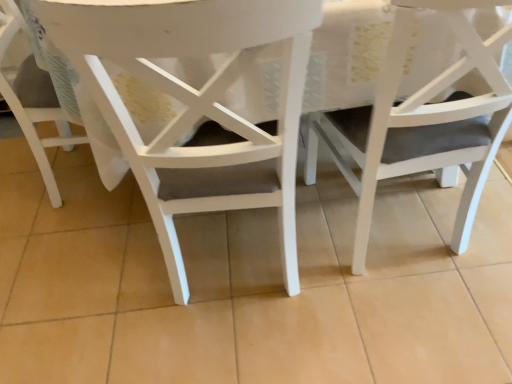
Question: Is white matte chair at center, which appears as the second chair when viewed from the left, completely or partially inside white matte chair at lower left, marked as the third chair in a right-to-left arrangement?

Choices:
 (A) no
 (B) yes

Answer: (A)

Question: From the image's perspective, is white matte chair at lower left, marked as the third chair in a right-to-left arrangement, on white matte chair at center, which appears as the second chair when viewed from the left?

Choices:
 (A) yes
 (B) no

Answer: (A)

Question: Is white matte chair at lower left, which is the first chair in left-to-right order, positioned behind white matte chair at center, which appears as the second chair when viewed from the left?

Choices:
 (A) yes
 (B) no

Answer: (A)

Question: Are white matte chair at lower left, which is the first chair in left-to-right order, and white matte chair at center, which appears as the second chair when viewed from the left, beside each other?

Choices:
 (A) no
 (B) yes

Answer: (A)

Question: From a real-world perspective, is white matte chair at lower left, which is the first chair in left-to-right order, below white matte chair at center, the second chair from the right?

Choices:
 (A) no
 (B) yes

Answer: (B)

Question: Is point (168, 44) closer or farther from the camera than point (463, 1)?

Choices:
 (A) farther
 (B) closer

Answer: (B)

Question: From the image's perspective, is white matte chair at center, the second chair from the right, above or below matte white chair at center, the 3th chair from the left?

Choices:
 (A) above
 (B) below

Answer: (B)

Question: From a real-world perspective, is white matte chair at center, the second chair from the right, positioned above or below matte white chair at center, the 3th chair from the left?

Choices:
 (A) below
 (B) above

Answer: (B)

Question: Is white matte chair at center, the second chair from the right, wider or thinner than matte white chair at center, the 3th chair from the left?

Choices:
 (A) wide
 (B) thin

Answer: (B)

Question: Is matte white chair at center, which is counted as the 1th chair, starting from the right, to the left or to the right of white matte chair at center, which appears as the second chair when viewed from the left, in the image?

Choices:
 (A) right
 (B) left

Answer: (A)

Question: Considering the positions of matte white chair at center, which is counted as the 1th chair, starting from the right, and white matte chair at center, which appears as the second chair when viewed from the left, in the image, is matte white chair at center, which is counted as the 1th chair, starting from the right, bigger or smaller than white matte chair at center, which appears as the second chair when viewed from the left,?

Choices:
 (A) big
 (B) small

Answer: (A)

Question: In terms of height, does matte white chair at center, the 3th chair from the left, look taller or shorter compared to white matte chair at center, which appears as the second chair when viewed from the left?

Choices:
 (A) tall
 (B) short

Answer: (B)

Question: From the image's perspective, is matte white chair at center, the 3th chair from the left, above or below white matte chair at center, which appears as the second chair when viewed from the left?

Choices:
 (A) above
 (B) below

Answer: (A)

Question: Is white matte chair at lower left, which is the first chair in left-to-right order, in front of or behind matte white chair at center, which is counted as the 1th chair, starting from the right, in the image?

Choices:
 (A) behind
 (B) front

Answer: (A)

Question: From a real-world perspective, is white matte chair at lower left, which is the first chair in left-to-right order, positioned above or below matte white chair at center, the 3th chair from the left?

Choices:
 (A) below
 (B) above

Answer: (A)